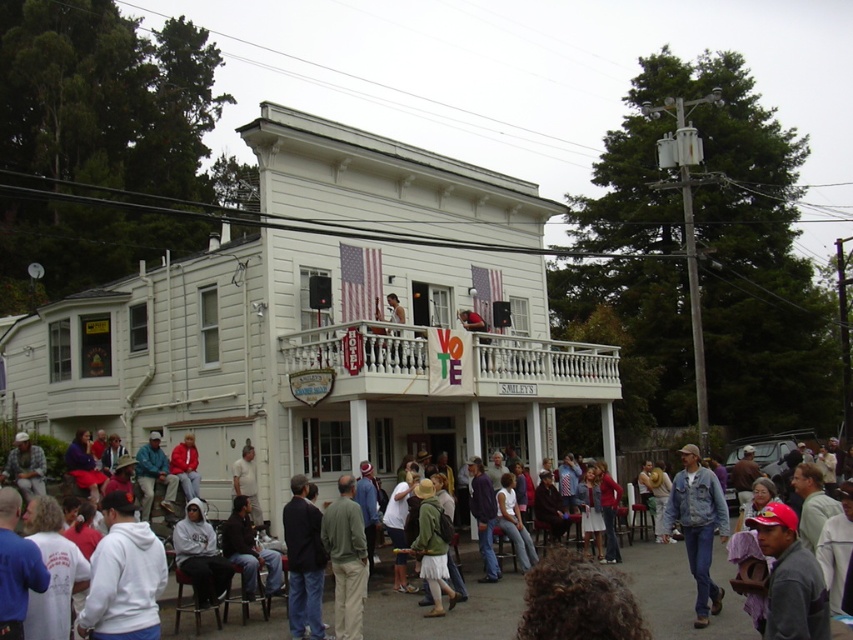
Question: Considering the real-world distances, which object is closest to the white hoodie at lower left?

Choices:
 (A) dark blue jeans at center
 (B) red cap at lower right
 (C) green fabric jacket at center
 (D) white fleece jacket at lower left

Answer: (A)

Question: Can you confirm if denim jacket at lower right is positioned to the right of white hoodie at lower left?

Choices:
 (A) yes
 (B) no

Answer: (A)

Question: Which of the following is the farthest from the observer?

Choices:
 (A) green fabric jacket at center
 (B) denim jacket at center
 (C) white hoodie at lower left

Answer: (C)

Question: Can you confirm if red cap at lower right is positioned to the left of denim jacket at lower right?

Choices:
 (A) no
 (B) yes

Answer: (B)

Question: Which point is closer to the camera taking this photo?

Choices:
 (A) (183, 532)
 (B) (704, 538)
 (C) (724, 604)

Answer: (B)

Question: From the image, what is the correct spatial relationship of white fleece jacket at lower left in relation to red cap at lower right?

Choices:
 (A) below
 (B) above

Answer: (A)